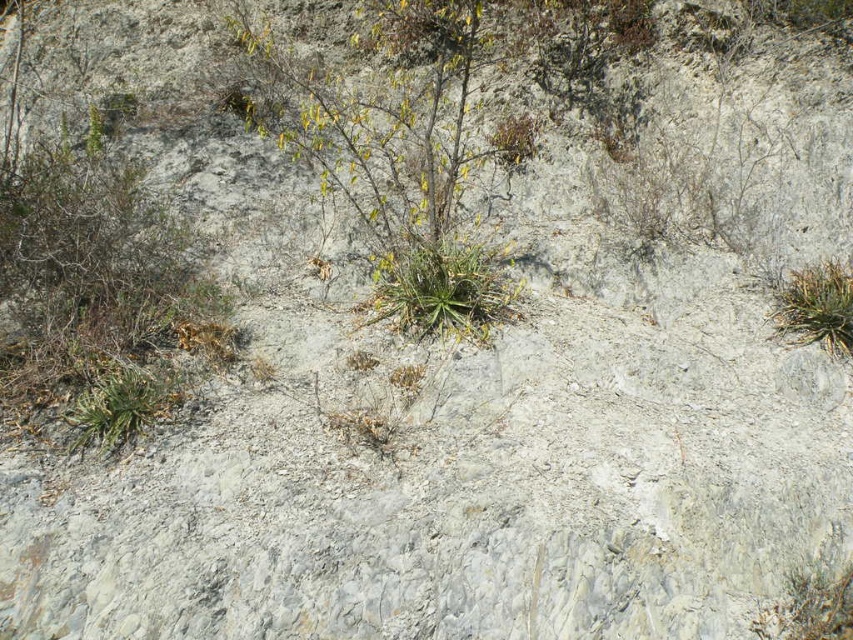
You are a botanist studying the vegetation in this rocky terrain. You notice a point of interest at coordinates point (442, 291). What type of vegetation is located at that specific coordinate?

The point (442, 291) corresponds to a green leafy plant at center, so the vegetation at that coordinate is a green leafy plant.